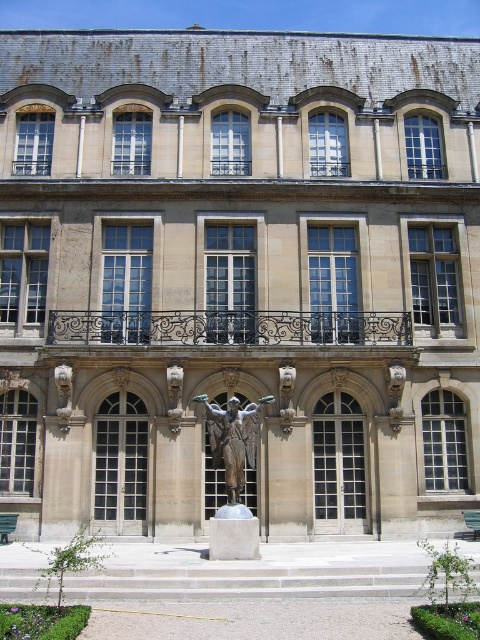
Question: Is black wrought iron balcony at center to the right of bronze statue at center from the viewer's perspective?

Choices:
 (A) yes
 (B) no

Answer: (B)

Question: Does black wrought iron balcony at center lie in front of bronze statue at center?

Choices:
 (A) yes
 (B) no

Answer: (B)

Question: Which object is closer to the camera taking this photo?

Choices:
 (A) bronze statue at center
 (B) black wrought iron balcony at center

Answer: (A)

Question: Does black wrought iron balcony at center appear on the left side of bronze statue at center?

Choices:
 (A) no
 (B) yes

Answer: (B)

Question: Which of the following is the farthest from the observer?

Choices:
 (A) black wrought iron balcony at center
 (B) bronze statue at center

Answer: (A)